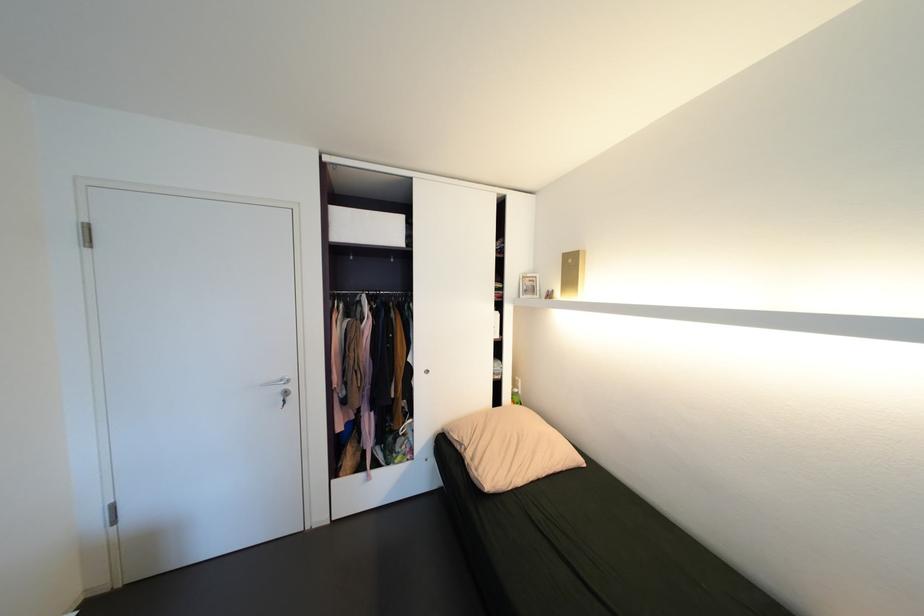
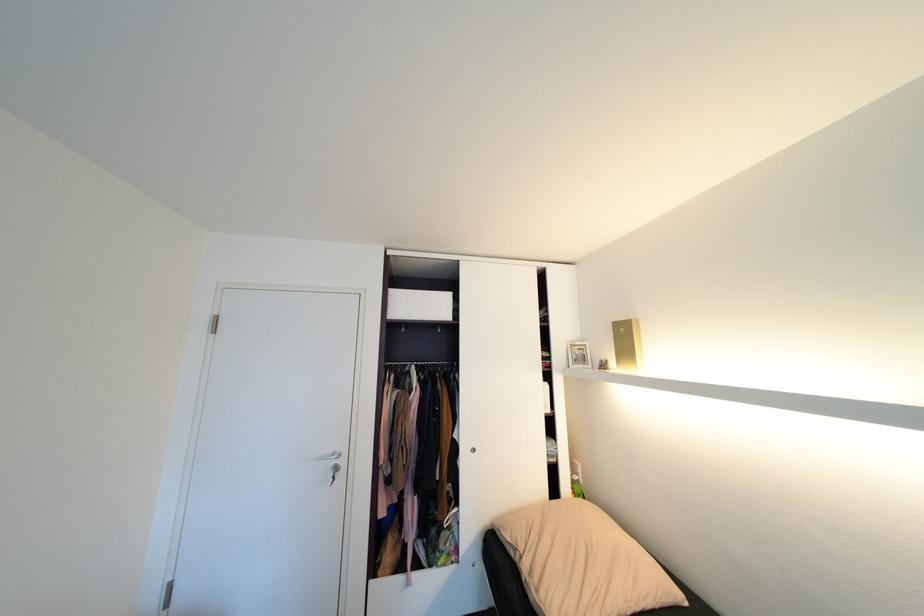
In the second image, find the point that corresponds to (269,386) in the first image.

(322, 459)